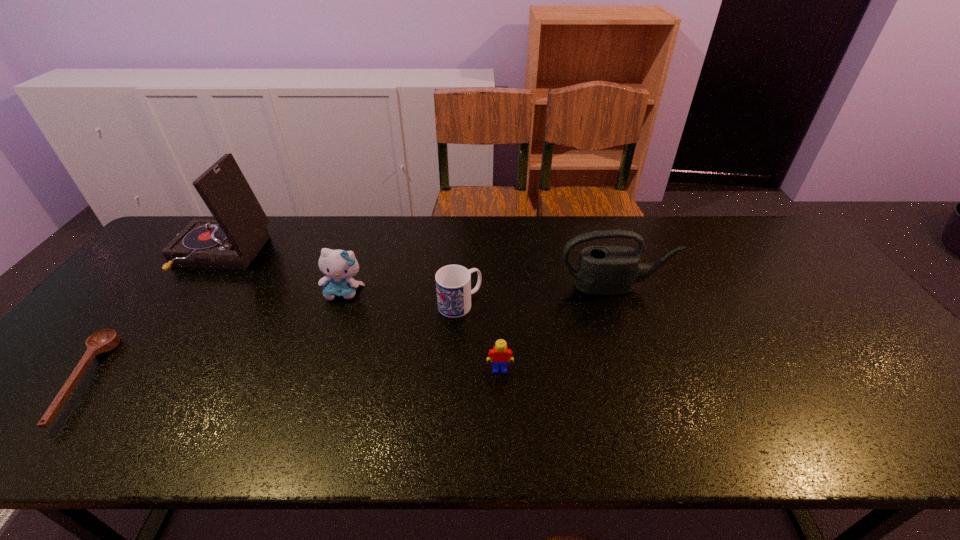
Where is `phonograph record`? This screenshot has height=540, width=960. phonograph record is located at coordinates tap(231, 241).

The width and height of the screenshot is (960, 540). In order to click on the rightmost object in this screenshot , I will do `click(602, 270)`.

What are the coordinates of `the fifth shortest object` in the screenshot? It's located at (602, 270).

This screenshot has width=960, height=540. I want to click on the third tallest object, so click(339, 265).

Where is `kitten`? The height and width of the screenshot is (540, 960). kitten is located at coordinates (339, 265).

In order to click on mug in this screenshot , I will do `click(453, 282)`.

Where is `Lego`? The image size is (960, 540). Lego is located at coordinates (501, 355).

Locate an element on the screen. wooden spoon is located at coordinates (105, 340).

Identify the location of vacant space situated on the right of the phonograph record. coord(285,257).

Where is `vacant space located 0.200m on the spout of the rightmost object`? This screenshot has height=540, width=960. vacant space located 0.200m on the spout of the rightmost object is located at coordinates (637, 352).